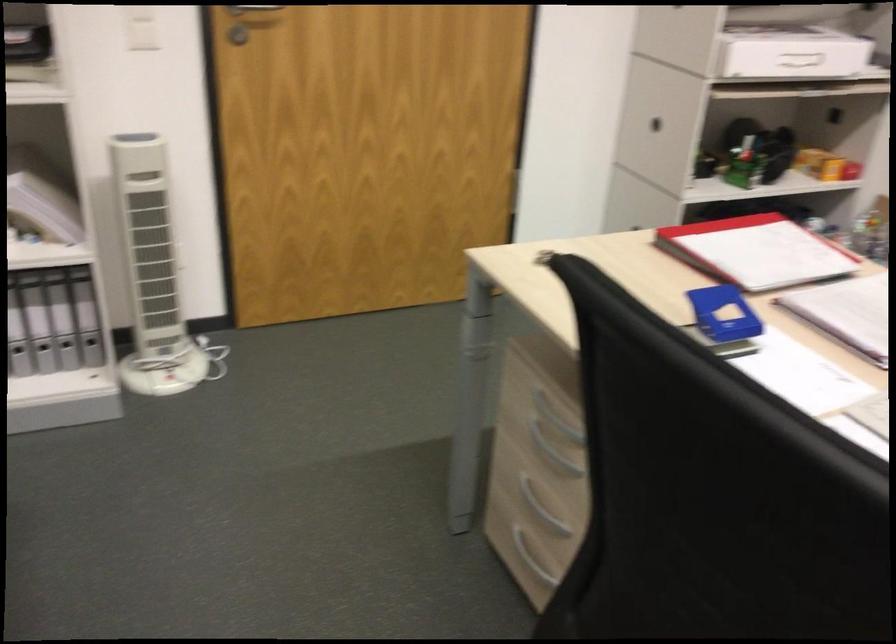
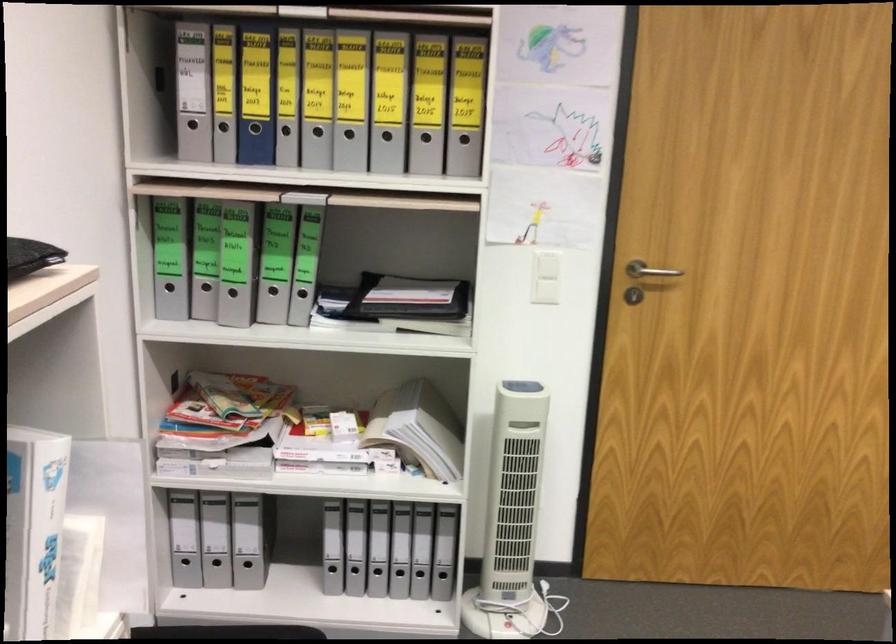
Which direction would the cameraman need to move to produce the second image?

The movement direction of the cameraman is left, forward.